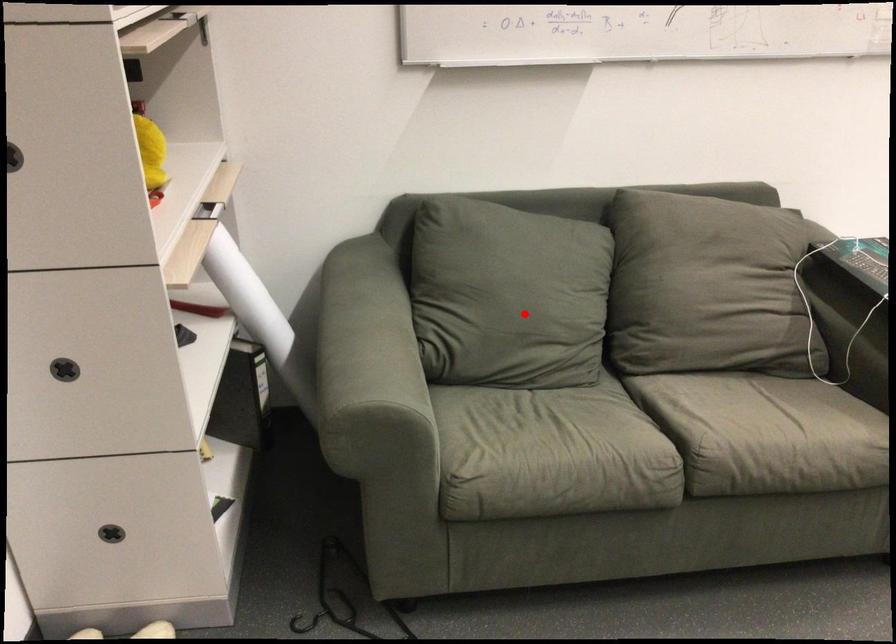
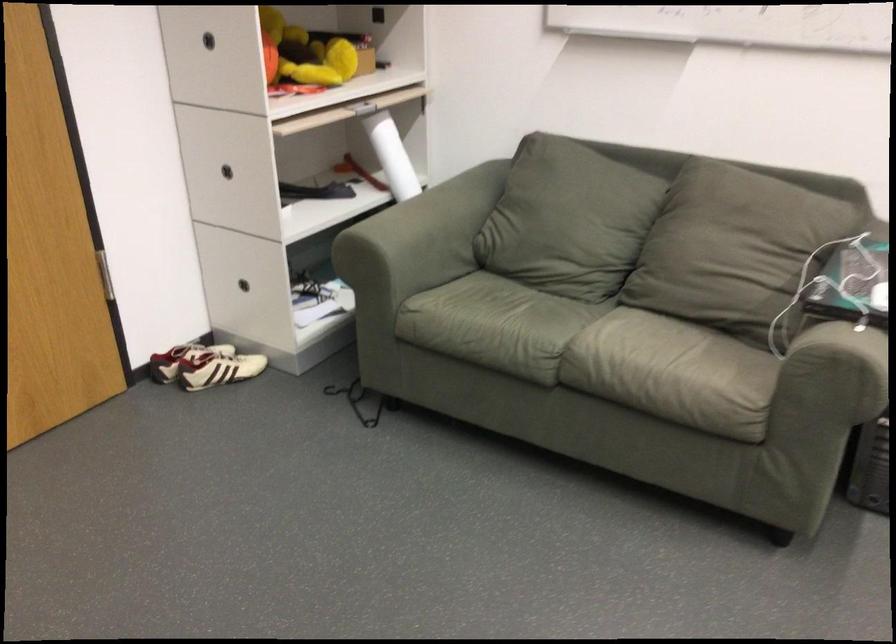
The point at the highlighted location is marked in the first image. Where is the corresponding point in the second image?

(558, 232)